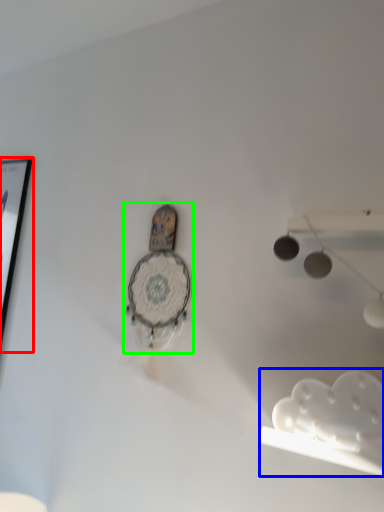
Question: Considering the real-world distances, which object is closest to picture frame (highlighted by a red box)? lamp (highlighted by a blue box) or clock (highlighted by a green box).

Choices:
 (A) lamp
 (B) clock

Answer: (B)